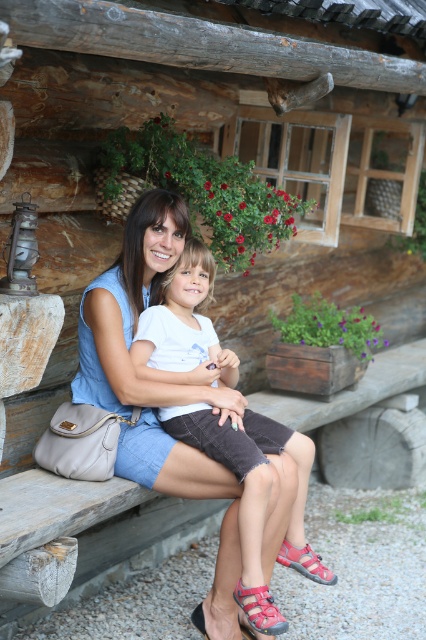
Question: Can you confirm if matte blue dress at center is positioned above red synthetic sandal at lower center?

Choices:
 (A) yes
 (B) no

Answer: (A)

Question: Among these points, which one is farthest from the camera?

Choices:
 (A) (204, 627)
 (B) (100, 381)
 (C) (259, 618)

Answer: (B)

Question: Which point appears farthest from the camera in this image?

Choices:
 (A) (264, 630)
 (B) (147, 420)

Answer: (B)

Question: Considering the relative positions of matte blue dress at center and pink fabric sandal at lower center in the image provided, where is matte blue dress at center located with respect to pink fabric sandal at lower center?

Choices:
 (A) left
 (B) right

Answer: (A)

Question: Which point is closer to the camera?

Choices:
 (A) red synthetic sandal at lower center
 (B) matte blue dress at center
 (C) pink fabric sandal at lower center
 (D) matte pink sandal at lower center

Answer: (C)

Question: Is matte pink sandal at lower center closer to the viewer compared to red synthetic sandal at lower center?

Choices:
 (A) yes
 (B) no

Answer: (B)